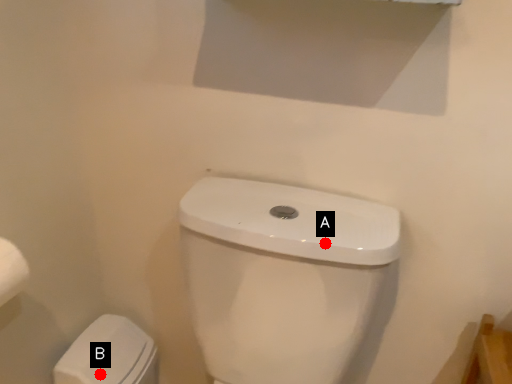
Question: Two points are circled on the image, labeled by A and B beside each circle. Which point is closer to the camera?

Choices:
 (A) A is closer
 (B) B is closer

Answer: (A)